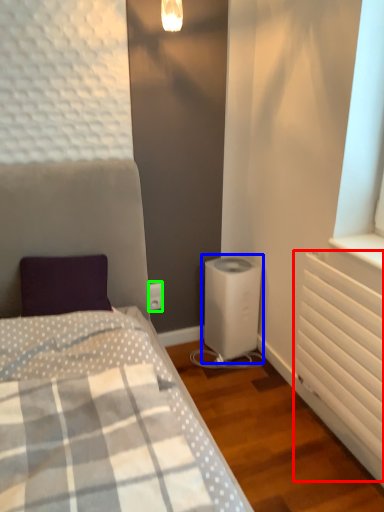
Question: Estimate the real-world distances between objects in this image. Which object is closer to radiator (highlighted by a red box), water heater (highlighted by a blue box) or electric outlet (highlighted by a green box)?

Choices:
 (A) water heater
 (B) electric outlet

Answer: (A)